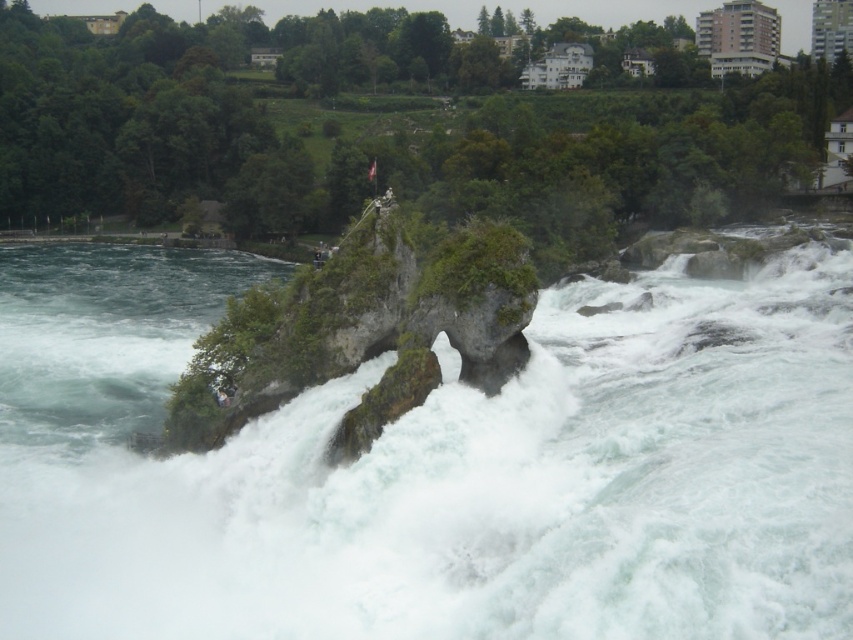
Can you confirm if white frothy water at center is positioned to the right of green mossy rock at center?

Indeed, white frothy water at center is positioned on the right side of green mossy rock at center.

Who is positioned more to the right, white frothy water at center or green mossy rock at center?

white frothy water at center

At what (x,y) coordinates should I click in order to perform the action: click on white frothy water at center. Please return your answer as a coordinate pair (x, y). Looking at the image, I should click on (434, 467).